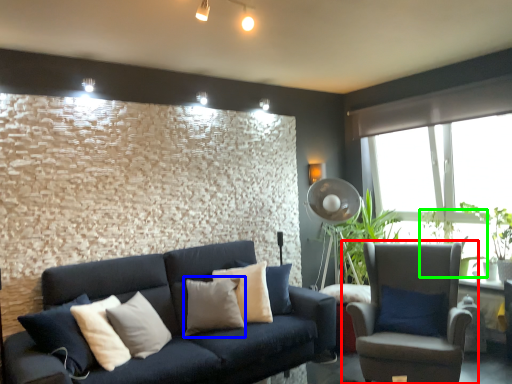
Question: Based on their relative distances, which object is nearer to chair (highlighted by a red box)? Choose from pillow (highlighted by a blue box) and plant (highlighted by a green box).

Choices:
 (A) pillow
 (B) plant

Answer: (B)